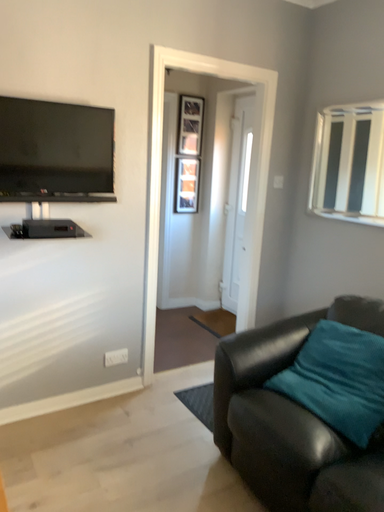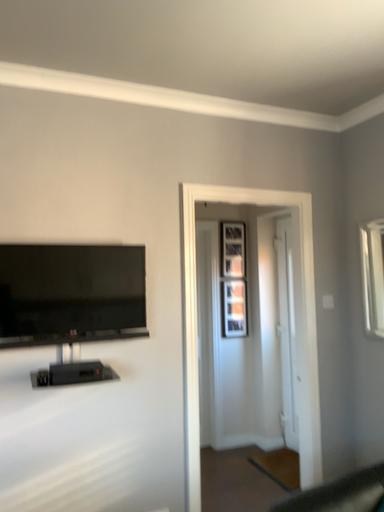
Question: How did the camera likely rotate when shooting the video?

Choices:
 (A) rotated right
 (B) rotated left

Answer: (B)